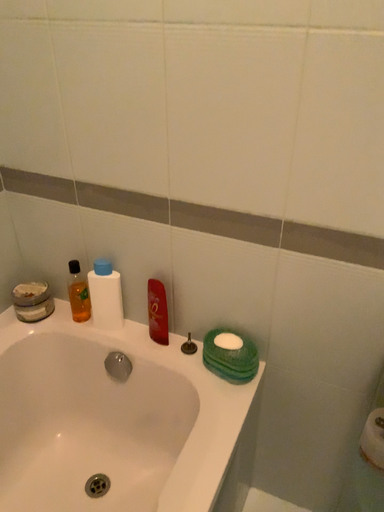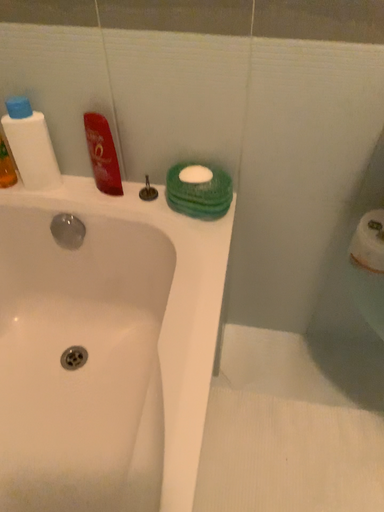
Question: How did the camera likely rotate when shooting the video?

Choices:
 (A) rotated upward
 (B) rotated downward

Answer: (B)